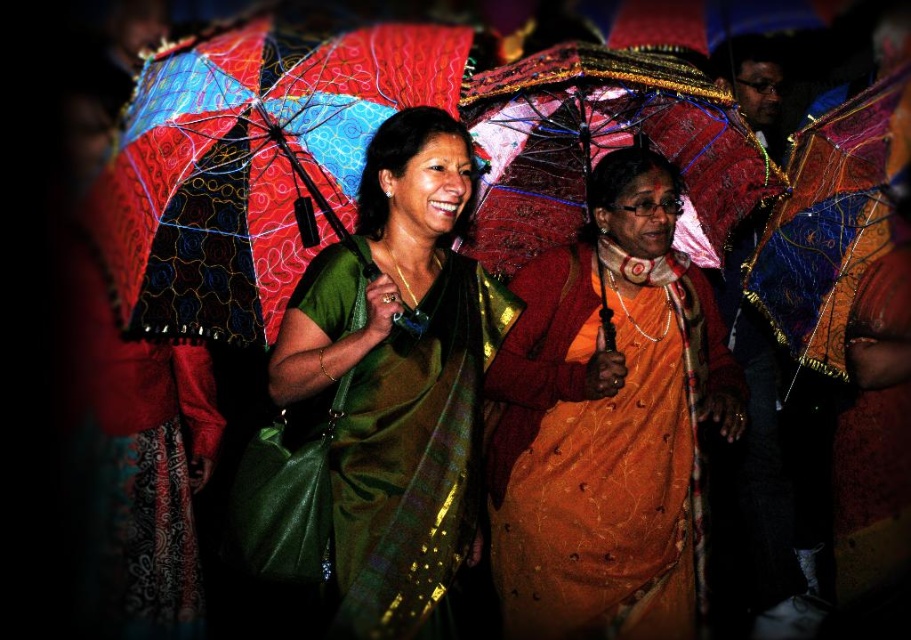
Consider the image. Is green silk saree at center thinner than textured fabric umbrella at upper center?

Yes.

Is green silk saree at center shorter than textured fabric umbrella at upper center?

No.

I want to click on green silk saree at center, so click(x=398, y=378).

Find the location of a particular element. The height and width of the screenshot is (640, 911). green silk saree at center is located at coordinates (398, 378).

Does orange silk saree at center have a smaller size compared to multicolored fabric umbrella at upper right?

Actually, orange silk saree at center might be larger than multicolored fabric umbrella at upper right.

Which is behind, point (669, 440) or point (828, 154)?

Positioned behind is point (828, 154).

Who is more forward, (x=515, y=339) or (x=892, y=99)?

Point (x=892, y=99)

The image size is (911, 640). Find the location of `orange silk saree at center`. orange silk saree at center is located at coordinates (607, 422).

Does multicolored fabric umbrella at upper right have a smaller size compared to textured fabric umbrella at upper center?

Correct, multicolored fabric umbrella at upper right occupies less space than textured fabric umbrella at upper center.

Does multicolored fabric umbrella at upper right have a larger size compared to textured fabric umbrella at upper center?

Incorrect, multicolored fabric umbrella at upper right is not larger than textured fabric umbrella at upper center.

Identify the location of multicolored fabric umbrella at upper right. (838, 232).